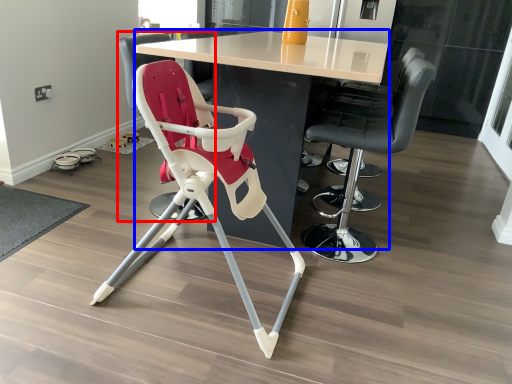
Question: Which object appears farthest to the camera in this image, chair (highlighted by a red box) or table (highlighted by a blue box)?

Choices:
 (A) chair
 (B) table

Answer: (A)